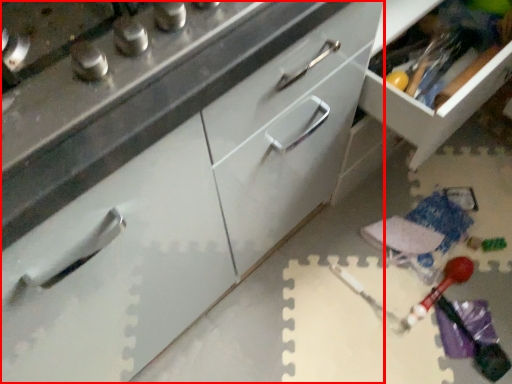
Question: From the image's perspective, what is the correct spatial relationship of cabinetry (annotated by the red box) in relation to cabinetry?

Choices:
 (A) above
 (B) below

Answer: (B)